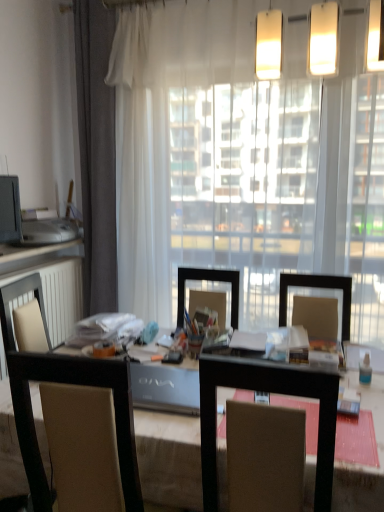
Question: Would you say matte white countertop at left is to the left or to the right of gray fabric curtain at left in the picture?

Choices:
 (A) right
 (B) left

Answer: (B)

Question: Do you think matte white countertop at left is within gray fabric curtain at left, or outside of it?

Choices:
 (A) outside
 (B) inside

Answer: (A)

Question: Considering the real-world distances, which object is closest to the brown fabric chair at center?

Choices:
 (A) matte black monitor at left
 (B) matte white countertop at left
 (C) gray fabric curtain at left
 (D) transparent curtain at center
 (E) white matte radiator at left

Answer: (E)

Question: Which of these objects is positioned farthest from the matte white countertop at left?

Choices:
 (A) white matte radiator at left
 (B) transparent curtain at center
 (C) wooden table at center
 (D) gray fabric curtain at left
 (E) matte black monitor at left

Answer: (C)